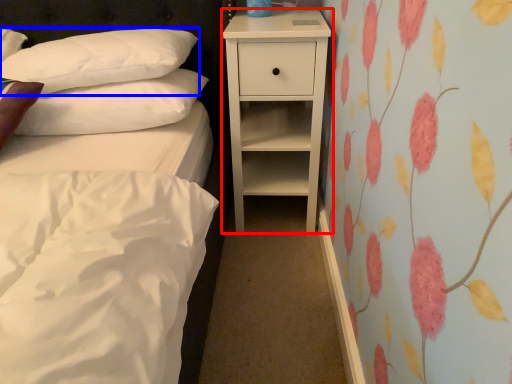
Question: Among these objects, which one is nearest to the camera, nightstand (highlighted by a red box) or pillow (highlighted by a blue box)?

Choices:
 (A) nightstand
 (B) pillow

Answer: (B)